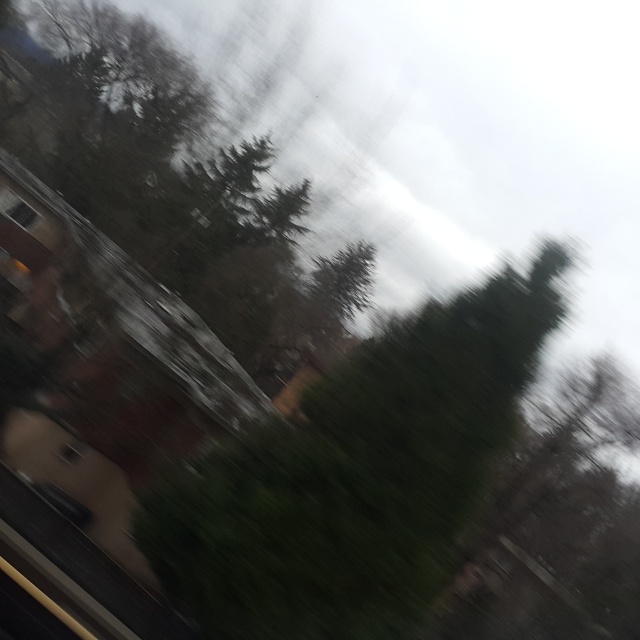
Question: Where is green leafy tree at center located in relation to transparent glass window at upper left in the image?

Choices:
 (A) above
 (B) below

Answer: (B)

Question: Which of the following is the closest to the observer?

Choices:
 (A) (22, 204)
 (B) (148, 36)
 (C) (352, 467)

Answer: (C)

Question: Can you confirm if green leafy tree at center is positioned above green leafy tree at upper left?

Choices:
 (A) no
 (B) yes

Answer: (A)

Question: Is green leafy tree at center below transparent glass window at upper left?

Choices:
 (A) yes
 (B) no

Answer: (A)

Question: Which point is farther to the camera?

Choices:
 (A) transparent glass window at upper left
 (B) green leafy tree at upper left
 (C) green leafy tree at center

Answer: (A)

Question: Which point appears farthest from the camera in this image?

Choices:
 (A) (253, 184)
 (B) (422, 552)
 (C) (22, 211)

Answer: (A)